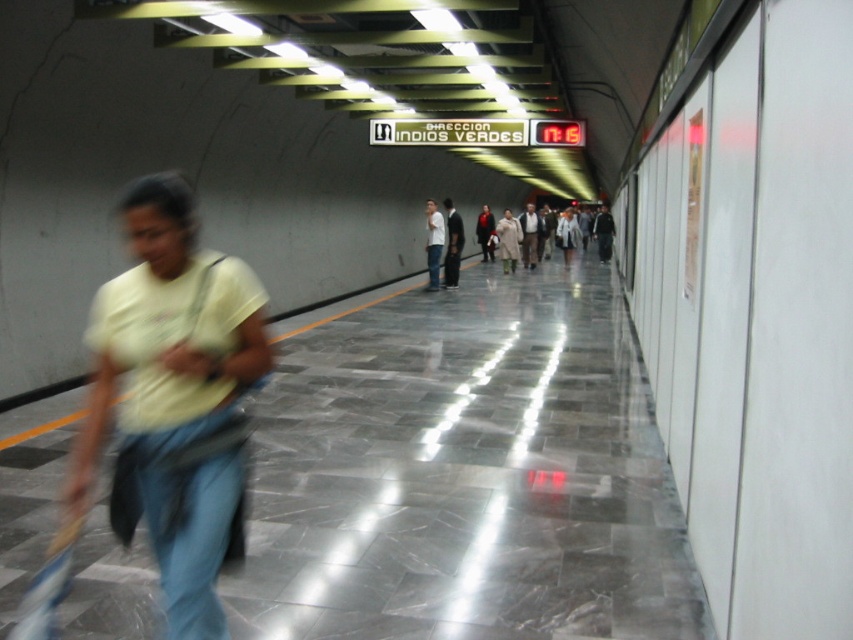
You are a photographer standing in the subway corridor. You want to take a photo of the white shirt at center and the light beige coat at center. The camera has a maximum focus range of 4 meters. Can you capture both subjects in focus without moving?

The white shirt at center is 4.68 meters from the light beige coat at center. Since the distance between them exceeds the camera maximum focus range of 4 meters, you cannot capture both subjects in focus without moving.

You are a photographer standing in the subway corridor and want to take a photo of the blue denim jeans at left and the light beige coat at center. Which object is located more to the left in the image?

The blue denim jeans at left is positioned more to the left than the light beige coat at center.